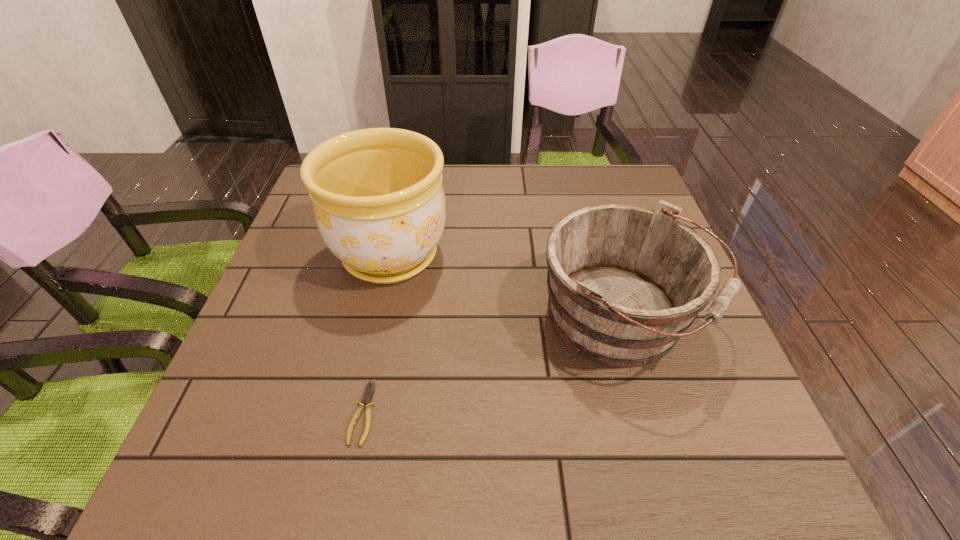
This screenshot has width=960, height=540. In order to click on vacant area that lies between the rightmost object and the flowerpot in this screenshot , I will do `click(506, 287)`.

Identify the location of vacant space in between the pliers and the tallest object. (376, 334).

Where is `vacant area that lies between the second shortest object and the tallest object`? The width and height of the screenshot is (960, 540). vacant area that lies between the second shortest object and the tallest object is located at coordinates (506, 287).

The width and height of the screenshot is (960, 540). Identify the location of vacant area between the rightmost object and the pliers. (492, 366).

You are a GUI agent. You are given a task and a screenshot of the screen. Output one action in this format:
    pyautogui.click(x=<x>, y=<y>)
    Task: Click on the empty space between the flowerpot and the second tallest object
    The height and width of the screenshot is (540, 960).
    Given the screenshot: What is the action you would take?
    pyautogui.click(x=506, y=287)

You are a GUI agent. You are given a task and a screenshot of the screen. Output one action in this format:
    pyautogui.click(x=<x>, y=<y>)
    Task: Click on the vacant region between the shortest object and the flowerpot
    
    Given the screenshot: What is the action you would take?
    pyautogui.click(x=376, y=334)

This screenshot has width=960, height=540. I want to click on vacant space that is in between the tallest object and the second tallest object, so click(506, 287).

Locate which object is the closest to the flowerpot. Please provide its 2D coordinates. Your answer should be formatted as a tuple, i.e. [(x, y)], where the tuple contains the x and y coordinates of a point satisfying the conditions above.

[(625, 282)]

Identify the location of object that is the closest to the pliers. This screenshot has width=960, height=540. (378, 200).

What are the coordinates of `blank area in the image that satisfies the following two spatial constraints: 1. on the back side of the rightmost object; 2. on the left side of the pliers` in the screenshot? It's located at (381, 320).